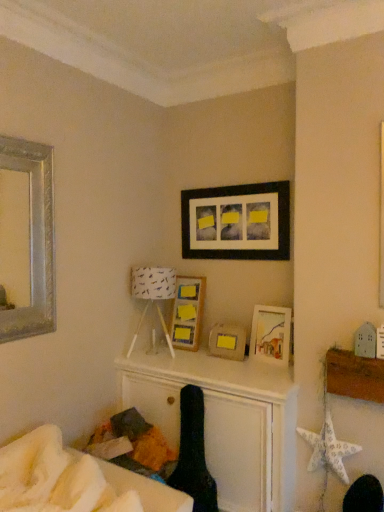
Question: Is white fabric lampshade at center wider than matte wooden picture frame at center-right, which is the 1th picture frame from right to left?

Choices:
 (A) yes
 (B) no

Answer: (A)

Question: Is white fabric lampshade at center facing towards matte wooden picture frame at center-right, which is the fifth picture frame from left to right?

Choices:
 (A) no
 (B) yes

Answer: (A)

Question: Does white fabric lampshade at center have a lesser width compared to matte wooden picture frame at center-right, which is the 1th picture frame from right to left?

Choices:
 (A) no
 (B) yes

Answer: (A)

Question: Can you confirm if white fabric lampshade at center is shorter than matte wooden picture frame at center-right, which is the fifth picture frame from left to right?

Choices:
 (A) yes
 (B) no

Answer: (B)

Question: Would you say white fabric lampshade at center is outside matte wooden picture frame at center-right, which is the fifth picture frame from left to right?

Choices:
 (A) no
 (B) yes

Answer: (B)

Question: From the image's perspective, is white soft bed at lower left positioned above or below silver metallic mirror at upper left, the 5th picture frame when ordered from right to left?

Choices:
 (A) below
 (B) above

Answer: (A)

Question: Is point (29, 494) closer or farther from the camera than point (51, 216)?

Choices:
 (A) closer
 (B) farther

Answer: (A)

Question: Which is correct: white soft bed at lower left is inside silver metallic mirror at upper left, which is counted as the first picture frame, starting from the left, or outside of it?

Choices:
 (A) outside
 (B) inside

Answer: (A)

Question: Considering their positions, is white soft bed at lower left located in front of or behind silver metallic mirror at upper left, the 5th picture frame when ordered from right to left?

Choices:
 (A) front
 (B) behind

Answer: (A)

Question: From the image's perspective, relative to matte wooden picture frame at center-right, which is the fifth picture frame from left to right, is matte wooden picture frame at center, which is the third picture frame in right-to-left order, above or below?

Choices:
 (A) above
 (B) below

Answer: (B)

Question: Considering the positions of matte wooden picture frame at center, which ranks as the third picture frame in left-to-right order, and matte wooden picture frame at center-right, which is the 1th picture frame from right to left, in the image, is matte wooden picture frame at center, which ranks as the third picture frame in left-to-right order, taller or shorter than matte wooden picture frame at center-right, which is the 1th picture frame from right to left,?

Choices:
 (A) short
 (B) tall

Answer: (A)

Question: Is matte wooden picture frame at center, which ranks as the third picture frame in left-to-right order, bigger or smaller than matte wooden picture frame at center-right, which is the fifth picture frame from left to right?

Choices:
 (A) small
 (B) big

Answer: (A)

Question: Is point (233, 354) closer or farther from the camera than point (279, 333)?

Choices:
 (A) closer
 (B) farther

Answer: (B)

Question: Would you say white soft bed at lower left is inside or outside black fabric swivel chair at center?

Choices:
 (A) inside
 (B) outside

Answer: (B)

Question: Is white soft bed at lower left in front of or behind black fabric swivel chair at center in the image?

Choices:
 (A) behind
 (B) front

Answer: (B)